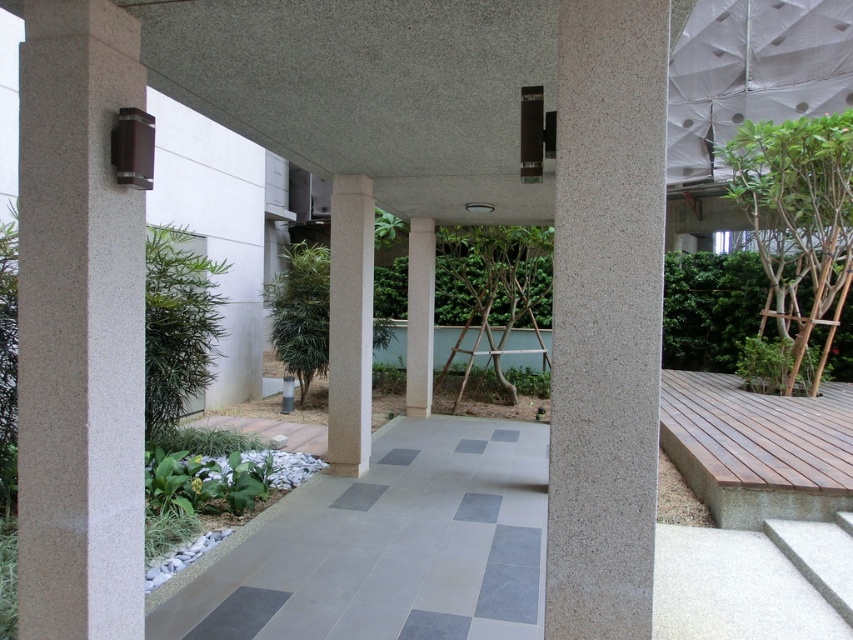
Does green leafy tree at right have a smaller size compared to smooth concrete pillar at center?

No, green leafy tree at right is not smaller than smooth concrete pillar at center.

Is green leafy tree at right positioned in front of smooth concrete pillar at center?

Yes.

Between point (799, 154) and point (410, 268), which one is positioned in front?

Positioned in front is point (799, 154).

At what (x,y) coordinates should I click in order to perform the action: click on green leafy tree at right. Please return your answer as a coordinate pair (x, y). This screenshot has height=640, width=853. Looking at the image, I should click on (799, 214).

Can you confirm if gray tile path at center is taller than green leafy tree at right?

No.

Between gray tile path at center and green leafy tree at right, which one is positioned lower?

Positioned lower is gray tile path at center.

Measure the distance between point (491, 628) and camera.

A distance of 9.85 feet exists between point (491, 628) and camera.

I want to click on gray tile path at center, so click(x=386, y=547).

Can you confirm if gray tile path at center is positioned above sanded concrete pillar at left?

No.

Image resolution: width=853 pixels, height=640 pixels. Find the location of `gray tile path at center`. gray tile path at center is located at coordinates (386, 547).

The image size is (853, 640). Describe the element at coordinates (386, 547) in the screenshot. I see `gray tile path at center` at that location.

Locate an element on the screen. The height and width of the screenshot is (640, 853). gray tile path at center is located at coordinates (386, 547).